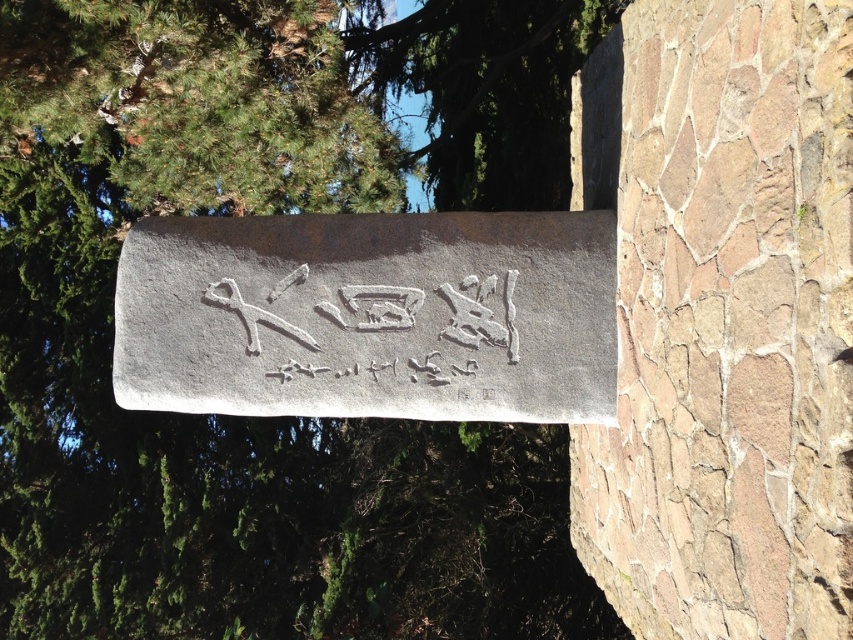
From the picture: Is white stone sign at center behind white carved stone at center?

No, white stone sign at center is closer to the viewer.

Is white stone sign at center positioned in front of white carved stone at center?

Yes, white stone sign at center is in front of white carved stone at center.

This screenshot has width=853, height=640. What do you see at coordinates (370, 316) in the screenshot?
I see `white stone sign at center` at bounding box center [370, 316].

Identify the location of white stone sign at center. The width and height of the screenshot is (853, 640). (370, 316).

Can you confirm if white stone sign at center is positioned above green leafy tree at upper center?

No.

Is point (366, 289) positioned before point (491, 13)?

Yes, it is.

Image resolution: width=853 pixels, height=640 pixels. In order to click on white stone sign at center in this screenshot , I will do `click(370, 316)`.

Can you confirm if green leafy tree at upper left is smaller than white carved stone at center?

Indeed, green leafy tree at upper left has a smaller size compared to white carved stone at center.

Based on the photo, is the position of green leafy tree at upper left less distant than that of white carved stone at center?

No, green leafy tree at upper left is behind white carved stone at center.

Which is behind, point (151, 497) or point (231, 305)?

Positioned behind is point (151, 497).

Where is `green leafy tree at upper left`? Image resolution: width=853 pixels, height=640 pixels. green leafy tree at upper left is located at coordinates (264, 419).